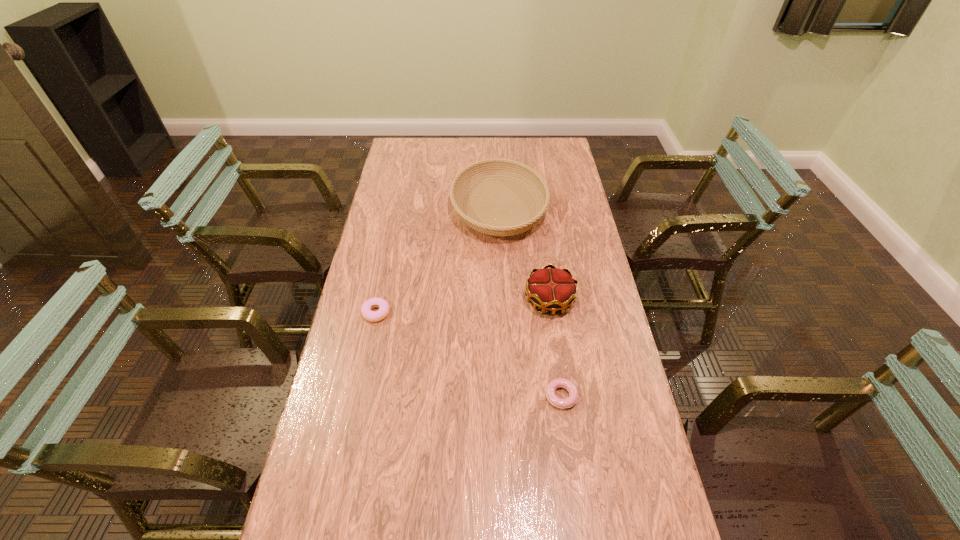
Identify the location of object at the left edge. The width and height of the screenshot is (960, 540). (374, 316).

Find the location of a particular element. Image resolution: width=960 pixels, height=540 pixels. basket that is positioned at the right edge is located at coordinates (498, 168).

Locate an element on the screen. Image resolution: width=960 pixels, height=540 pixels. crown positioned at the right edge is located at coordinates (552, 289).

Where is `doughnut positioned at the right edge`? The image size is (960, 540). doughnut positioned at the right edge is located at coordinates (560, 382).

In the image, there is a desktop. Where is `free region at the far edge`? The height and width of the screenshot is (540, 960). free region at the far edge is located at coordinates (501, 147).

Where is `vacant position at the left edge of the desktop`? vacant position at the left edge of the desktop is located at coordinates (390, 241).

This screenshot has height=540, width=960. In order to click on vacant space at the right edge of the desktop in this screenshot , I will do `click(573, 220)`.

Where is `unoccupied area between the nearest object and the left doughnut`? The image size is (960, 540). unoccupied area between the nearest object and the left doughnut is located at coordinates (468, 354).

Find the location of a particular element. The image size is (960, 540). blank region between the farther doughnut and the nearest object is located at coordinates (468, 354).

In order to click on free space between the farther doughnut and the farthest object in this screenshot , I will do `click(438, 261)`.